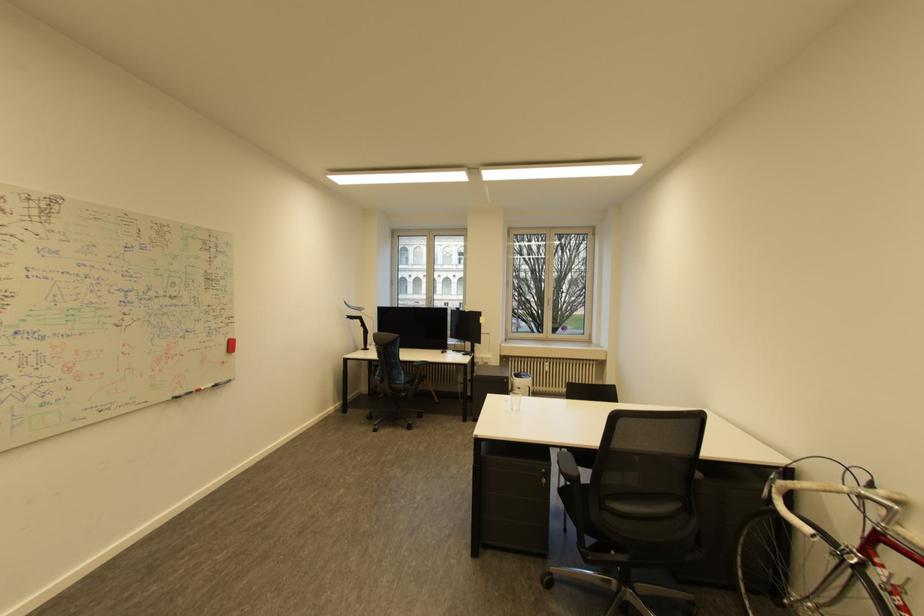
What do you see at coordinates (844, 505) in the screenshot? The width and height of the screenshot is (924, 616). I see `the bicycle handlebar` at bounding box center [844, 505].